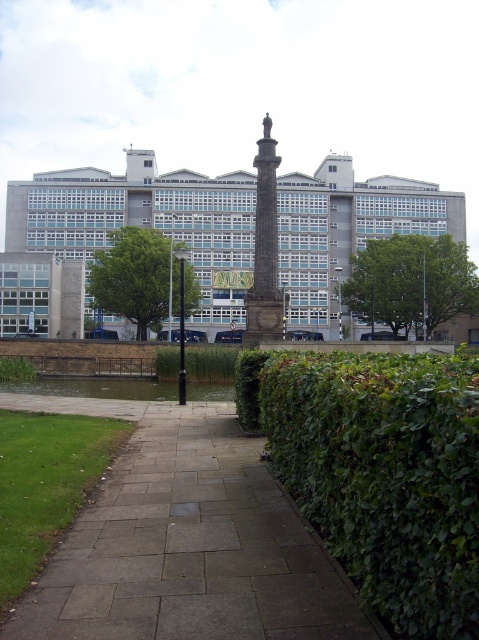
Question: Can you confirm if gray stone pavement at center is smaller than green leafy bush at left?

Choices:
 (A) no
 (B) yes

Answer: (B)

Question: Which object is farther from the camera taking this photo?

Choices:
 (A) green leafy bush at left
 (B) dark gray stone column at center
 (C) gray stone pavement at center

Answer: (A)

Question: Does green leafy bush at left appear on the right side of dark gray stone column at center?

Choices:
 (A) no
 (B) yes

Answer: (A)

Question: Which point appears closest to the camera in this image?

Choices:
 (A) (262, 204)
 (B) (114, 403)
 (C) (467, 282)
 (D) (158, 316)

Answer: (B)

Question: Among these objects, which one is nearest to the camera?

Choices:
 (A) gray stone pavement at center
 (B) green leafy hedge at right
 (C) dark gray stone column at center

Answer: (B)

Question: Is green leafy hedge at right further to the viewer compared to green leafy hedge at center?

Choices:
 (A) no
 (B) yes

Answer: (A)